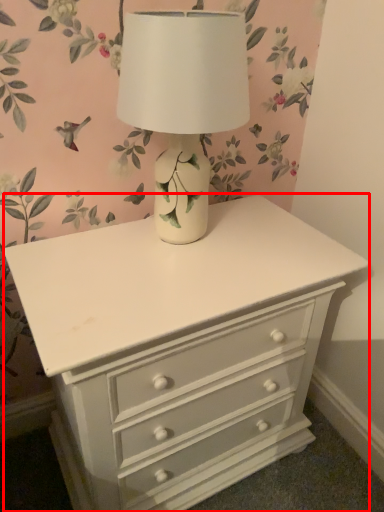
Question: From the image, what is the correct spatial relationship of chest of drawers (annotated by the red box) in relation to table lamp?

Choices:
 (A) left
 (B) right

Answer: (B)